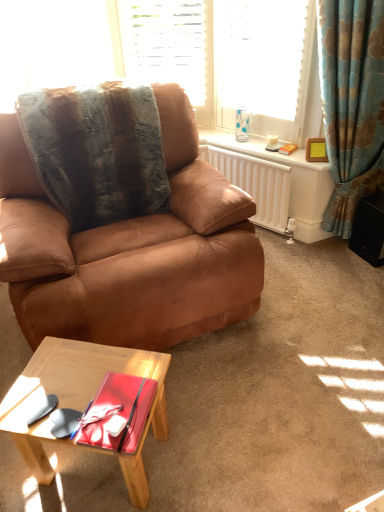
Identify the location of free space that is in between light wood coffee table at lower left and brown leather chair at center. The height and width of the screenshot is (512, 384). (204, 399).